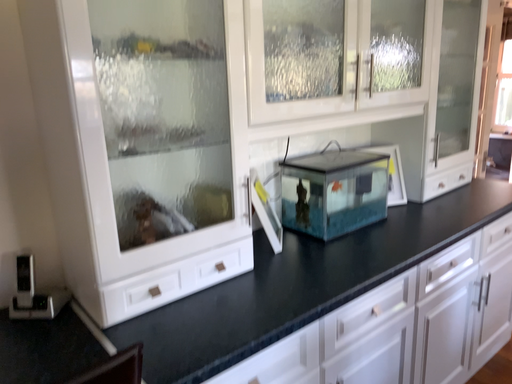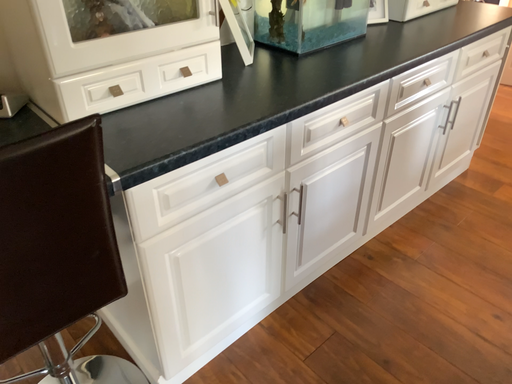
Question: Which way did the camera rotate in the video?

Choices:
 (A) rotated downward
 (B) rotated upward

Answer: (A)